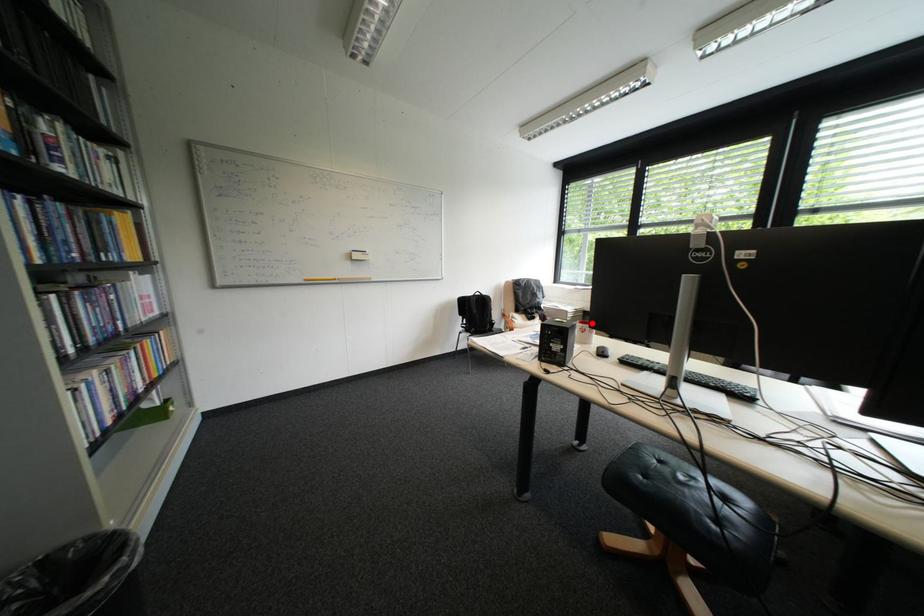
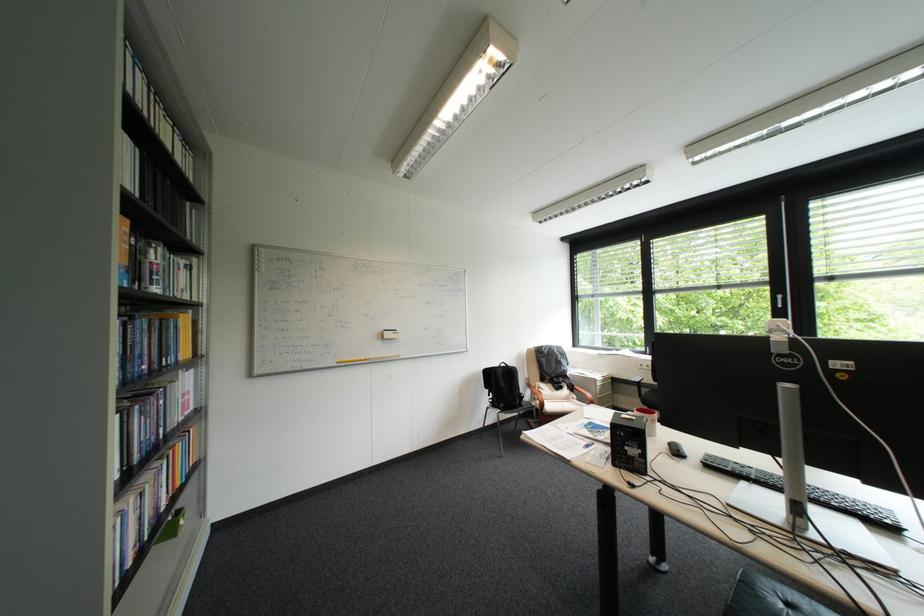
In the second image, find the point that corresponds to the highlighted location in the first image.

(650, 411)